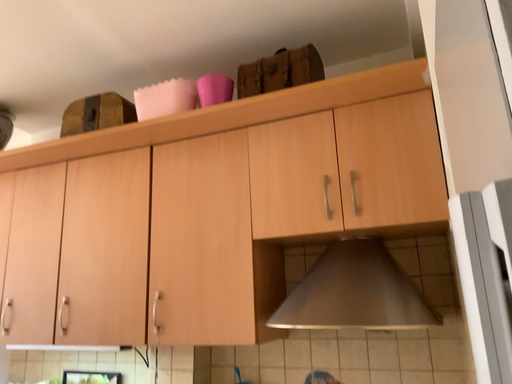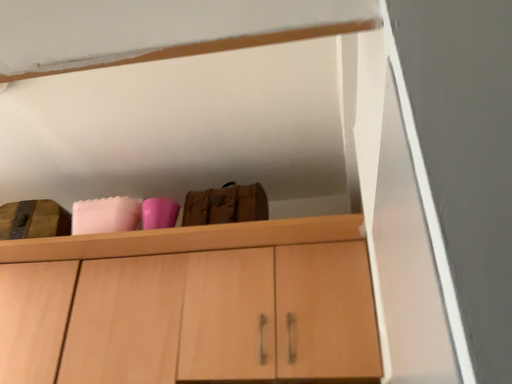
Question: Which way did the camera rotate in the video?

Choices:
 (A) rotated left
 (B) rotated right

Answer: (B)